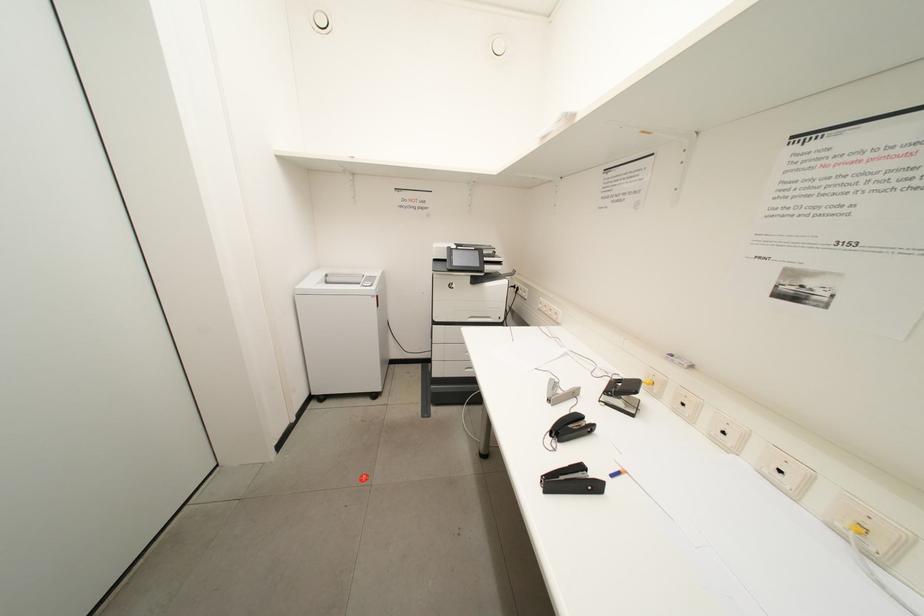
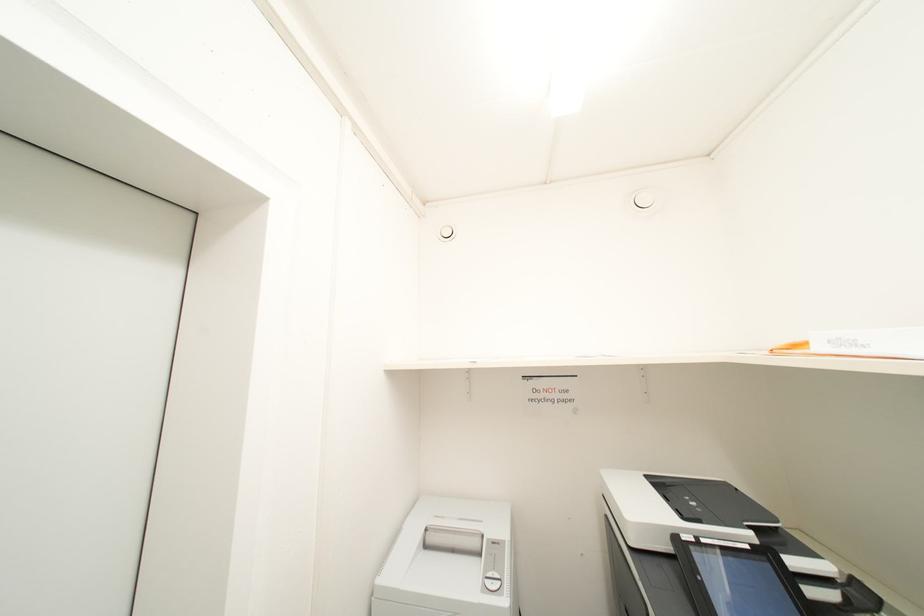
The first image is from the beginning of the video and the second image is from the end. How did the camera likely rotate when shooting the video?

The camera's rotation is toward left-up.